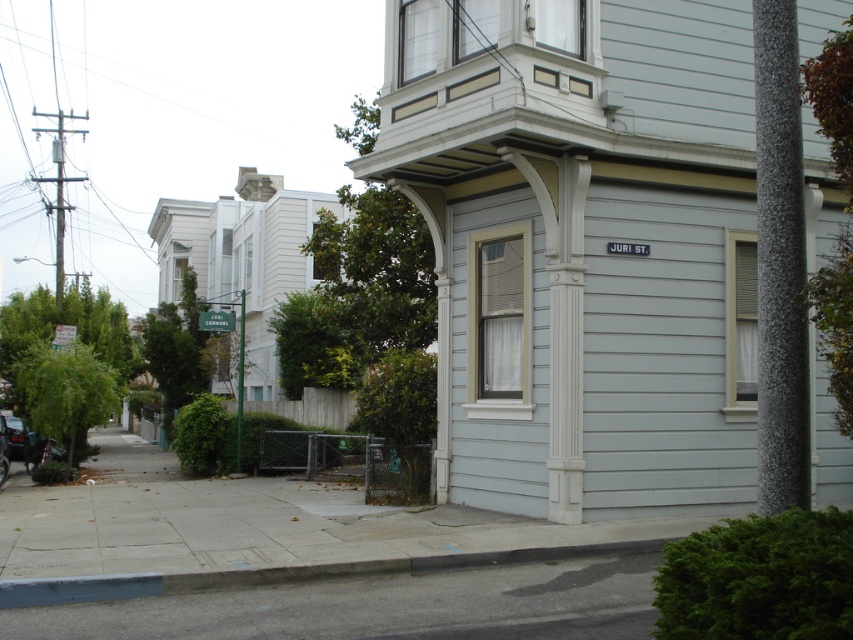
Question: Can you confirm if gray speckled pole at right is bigger than gray concrete curb at lower center?

Choices:
 (A) no
 (B) yes

Answer: (B)

Question: Is gray speckled pole at right smaller than gray concrete curb at lower center?

Choices:
 (A) no
 (B) yes

Answer: (A)

Question: Is gray speckled pole at right wider than shiny black car at lower left?

Choices:
 (A) yes
 (B) no

Answer: (B)

Question: Considering the real-world distances, which object is closest to the gray speckled pole at right?

Choices:
 (A) gray concrete curb at lower center
 (B) shiny black car at lower left

Answer: (A)

Question: Among these objects, which one is nearest to the camera?

Choices:
 (A) gray speckled pole at right
 (B) gray concrete curb at lower center

Answer: (A)

Question: Which point is farther from the camera taking this photo?

Choices:
 (A) (485, 554)
 (B) (27, 438)
 (C) (795, 230)

Answer: (B)